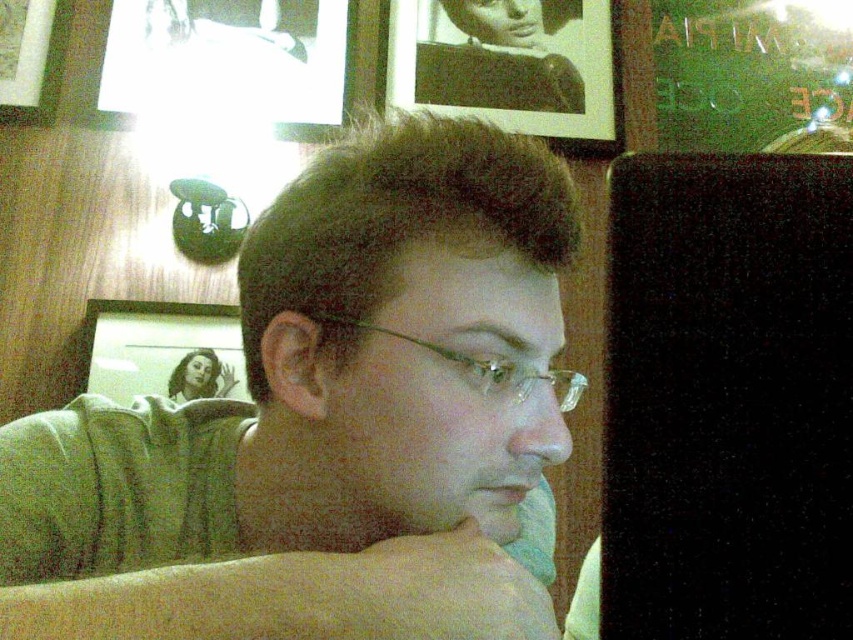
Question: Which object is closer to the camera taking this photo?

Choices:
 (A) green matte shirt at center
 (B) matte glass picture frame at upper left

Answer: (A)

Question: Is matte glass picture frame at upper left thinner than clear plastic glasses at center?

Choices:
 (A) no
 (B) yes

Answer: (A)

Question: Observing the image, what is the correct spatial positioning of white paper at upper center in reference to matte glass picture frame at upper left?

Choices:
 (A) right
 (B) left

Answer: (A)

Question: Which of the following is the farthest from the observer?

Choices:
 (A) (576, 385)
 (B) (248, 70)
 (C) (544, 131)
 (D) (509, 314)

Answer: (C)

Question: Is green matte shirt at center above matte glass picture frame at upper left?

Choices:
 (A) no
 (B) yes

Answer: (A)

Question: Which object appears closest to the camera in this image?

Choices:
 (A) black paper at upper center
 (B) clear plastic glasses at center

Answer: (B)